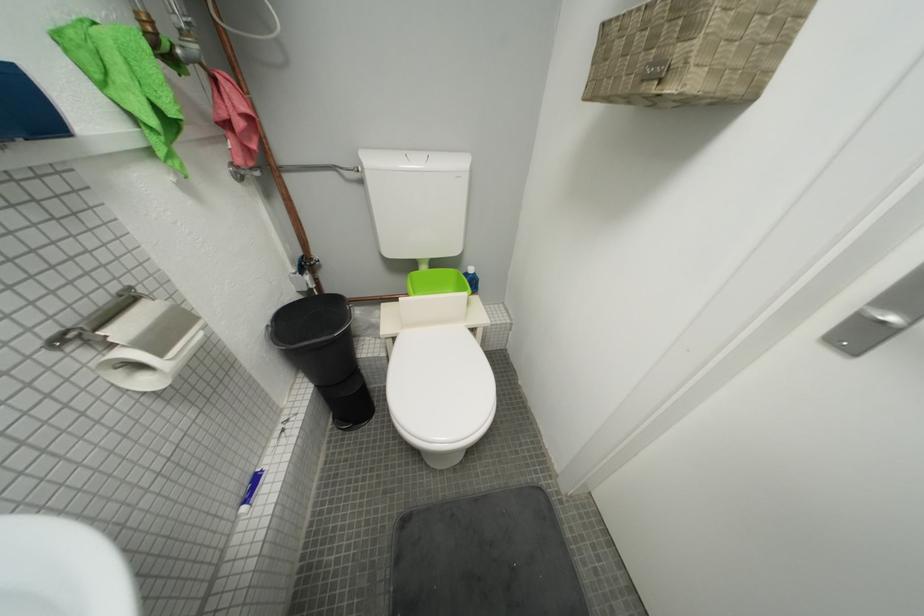
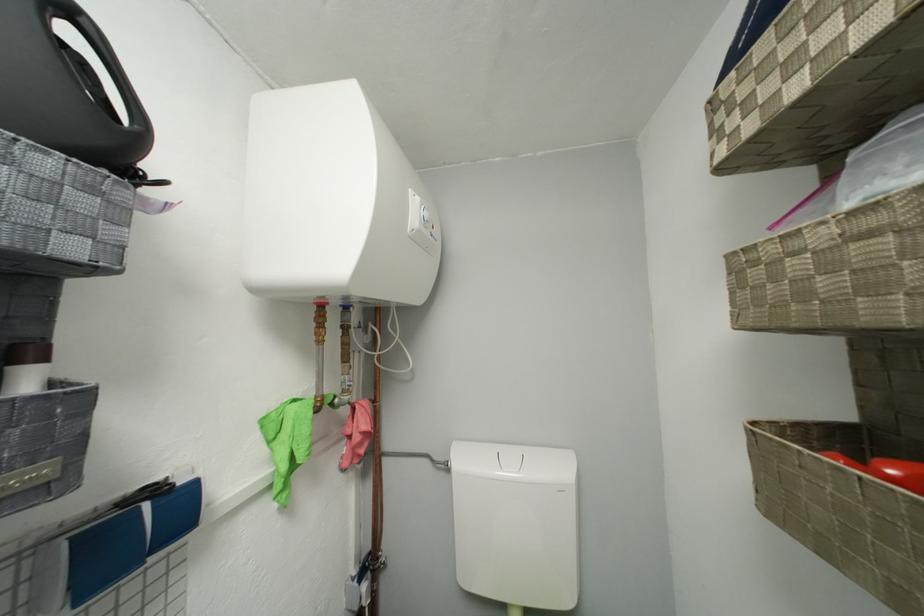
Find the pixel in the second image that matches pixel 233 116 in the first image.

(358, 435)